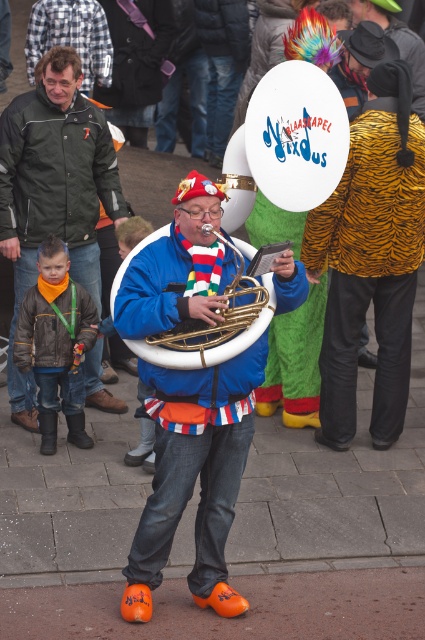
In the scene shown: You are standing on the street and want to take a photo of the gold brass tuba at center. If your camera can focus on objects up to 5 meters away, will you need to move closer?

The gold brass tuba at center is 5.26 meters away from the viewer. Since your camera can focus up to 5 meters, you need to move closer to ensure proper focus.

Consider the image. You are a street performer who needs to carry both the gold brass tuba at center and the gold brass trumpet at center from the stage to the storage room. Since you can only carry one instrument at a time, which instrument should you pick up first if you want to start with the one closer to your left side?

The gold brass tuba at center is to the left of the gold brass trumpet at center, so you should pick up the gold brass tuba at center first since it is closer to your left side.